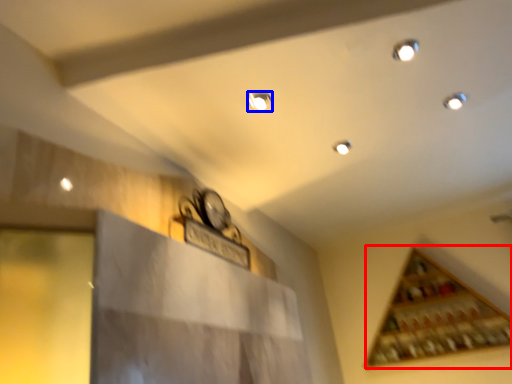
Question: Among these objects, which one is nearest to the camera, wine rack (highlighted by a red box) or light (highlighted by a blue box)?

Choices:
 (A) wine rack
 (B) light

Answer: (B)